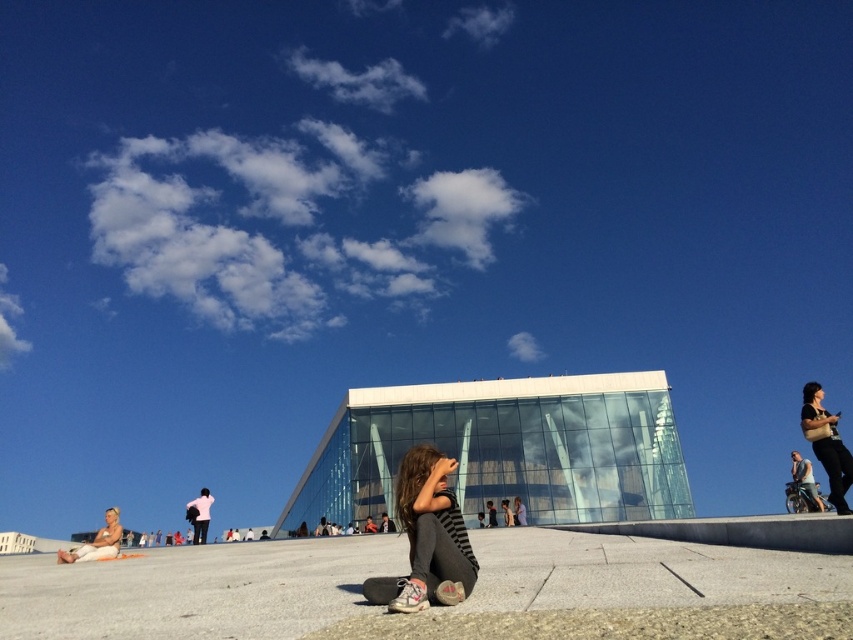
Question: Which point appears farthest from the camera in this image?

Choices:
 (A) (204, 541)
 (B) (820, 445)

Answer: (A)

Question: Observing the image, what is the correct spatial positioning of gray concrete at center in reference to striped fabric girl at center?

Choices:
 (A) right
 (B) left

Answer: (B)

Question: Estimate the real-world distances between objects in this image. Which object is farther from the matte black shirt at right?

Choices:
 (A) striped fabric girl at center
 (B) white matte shirt at upper center

Answer: (B)

Question: Is gray concrete at center in front of white matte shirt at upper center?

Choices:
 (A) yes
 (B) no

Answer: (A)

Question: Is striped fabric girl at center positioned at the back of matte black shirt at right?

Choices:
 (A) yes
 (B) no

Answer: (B)

Question: Which of the following is the farthest from the observer?

Choices:
 (A) gray concrete at center
 (B) white matte shirt at upper center
 (C) matte black shirt at right
 (D) striped fabric girl at center

Answer: (B)